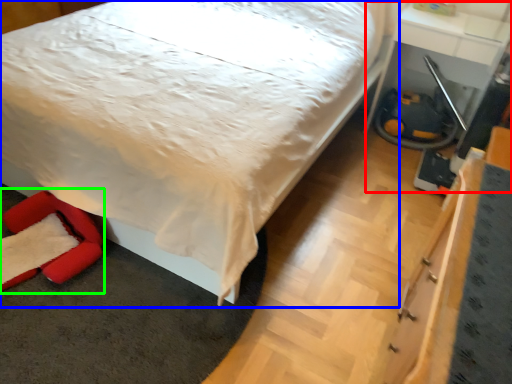
Question: Which object is positioned closest to table (highlighted by a red box)? Select from bed (highlighted by a blue box) and swivel chair (highlighted by a green box).

Choices:
 (A) bed
 (B) swivel chair

Answer: (A)